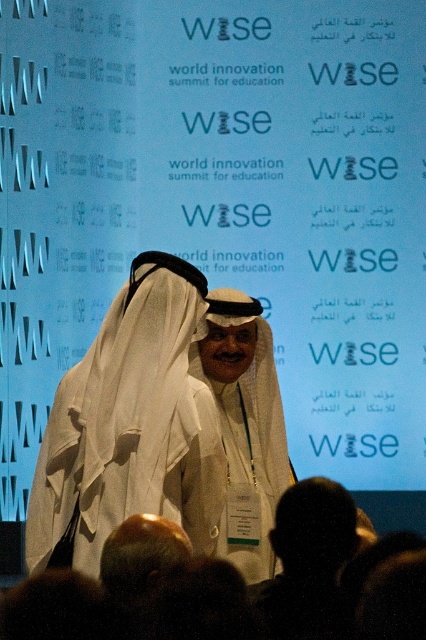
Can you confirm if white matte/soft fabric at center is shorter than white fabric headscarf at center?

In fact, white matte/soft fabric at center may be taller than white fabric headscarf at center.

Is white matte/soft fabric at center thinner than white fabric headscarf at center?

In fact, white matte/soft fabric at center might be wider than white fabric headscarf at center.

What do you see at coordinates (244, 426) in the screenshot? The height and width of the screenshot is (640, 426). I see `white matte/soft fabric at center` at bounding box center [244, 426].

Find the location of `white matte/soft fabric at center`. white matte/soft fabric at center is located at coordinates coord(244,426).

Based on the photo, can you confirm if white matte robe at center is thinner than white matte/soft fabric at center?

No, white matte robe at center is not thinner than white matte/soft fabric at center.

This screenshot has width=426, height=640. In order to click on white matte robe at center in this screenshot , I will do `click(129, 428)`.

Where is `white matte robe at center`? white matte robe at center is located at coordinates (129, 428).

Which is more to the left, white matte robe at center or white fabric headscarf at center?

Positioned to the left is white matte robe at center.

What do you see at coordinates (129, 428) in the screenshot? I see `white matte robe at center` at bounding box center [129, 428].

At what (x,y) coordinates should I click in order to perform the action: click on white matte robe at center. Please return your answer as a coordinate pair (x, y). The width and height of the screenshot is (426, 640). Looking at the image, I should click on (129, 428).